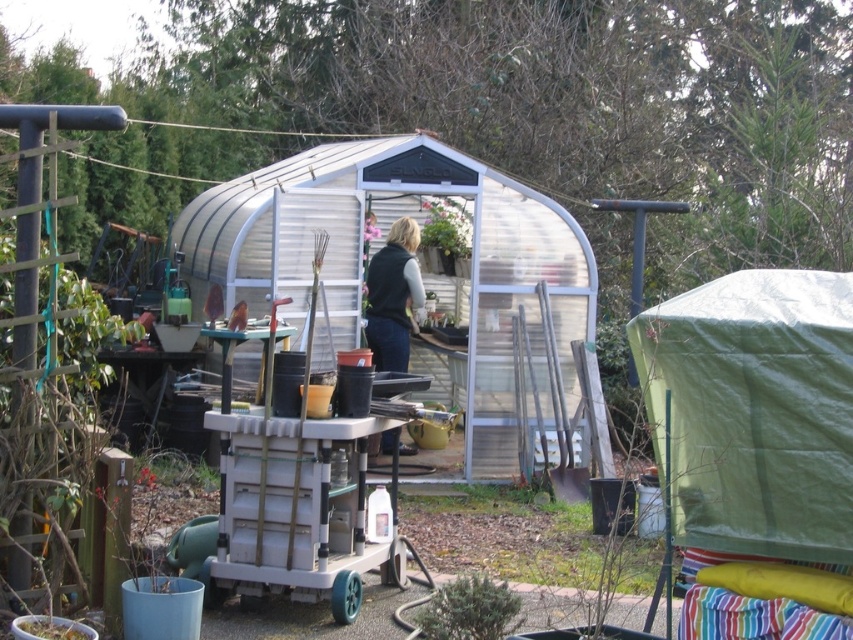
Does transparent plastic greenhouse at center have a lesser width compared to dark green fabric vest at center?

No, transparent plastic greenhouse at center is not thinner than dark green fabric vest at center.

You are a GUI agent. You are given a task and a screenshot of the screen. Output one action in this format:
    pyautogui.click(x=<x>, y=<y>)
    Task: Click on the transparent plastic greenhouse at center
    
    Given the screenshot: What is the action you would take?
    pyautogui.click(x=418, y=260)

Locate an element on the screen. This screenshot has width=853, height=640. transparent plastic greenhouse at center is located at coordinates (418, 260).

Does transparent plastic greenhouse at center appear on the left side of green matte bush at lower center?

Correct, you'll find transparent plastic greenhouse at center to the left of green matte bush at lower center.

What do you see at coordinates (418, 260) in the screenshot? The height and width of the screenshot is (640, 853). I see `transparent plastic greenhouse at center` at bounding box center [418, 260].

Is point (308, 259) farther from viewer compared to point (460, 604)?

That is True.

The width and height of the screenshot is (853, 640). Identify the location of transparent plastic greenhouse at center. (418, 260).

Which is above, white plastic cart at center or green matte pot at center?

green matte pot at center is above.

Between point (340, 611) and point (447, 225), which one is positioned in front?

Point (340, 611)

This screenshot has height=640, width=853. What do you see at coordinates (300, 512) in the screenshot? I see `white plastic cart at center` at bounding box center [300, 512].

I want to click on white plastic cart at center, so click(300, 512).